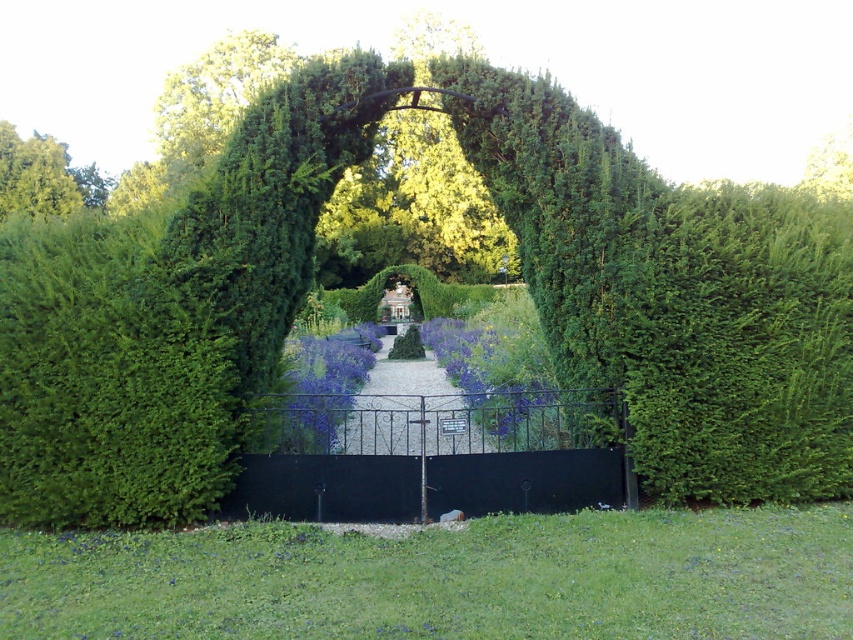
Who is shorter, black wrought iron gate at center or gravel path at center?

Standing shorter between the two is gravel path at center.

Is black wrought iron gate at center below gravel path at center?

Yes, black wrought iron gate at center is below gravel path at center.

Identify the location of black wrought iron gate at center. (428, 456).

You are a GUI agent. You are given a task and a screenshot of the screen. Output one action in this format:
    pyautogui.click(x=<x>, y=<y>)
    Task: Click on the black wrought iron gate at center
    Image resolution: width=853 pixels, height=640 pixels.
    Given the screenshot: What is the action you would take?
    pyautogui.click(x=428, y=456)

Can you confirm if green grass at lower center is bigger than gravel path at center?

No, green grass at lower center is not bigger than gravel path at center.

You are a GUI agent. You are given a task and a screenshot of the screen. Output one action in this format:
    pyautogui.click(x=<x>, y=<y>)
    Task: Click on the green grass at lower center
    
    Given the screenshot: What is the action you would take?
    pyautogui.click(x=445, y=579)

Find the location of a particular element. green grass at lower center is located at coordinates (445, 579).

The height and width of the screenshot is (640, 853). I want to click on green grass at lower center, so click(445, 579).

Which of these two, green leafy bush at center or black wrought iron gate at center, stands shorter?

black wrought iron gate at center is shorter.

Which is behind, point (65, 284) or point (341, 412)?

The point (341, 412) is more distant.

What do you see at coordinates (109, 380) in the screenshot?
I see `green leafy bush at center` at bounding box center [109, 380].

This screenshot has height=640, width=853. What are the coordinates of `green leafy bush at center` in the screenshot? It's located at (109, 380).